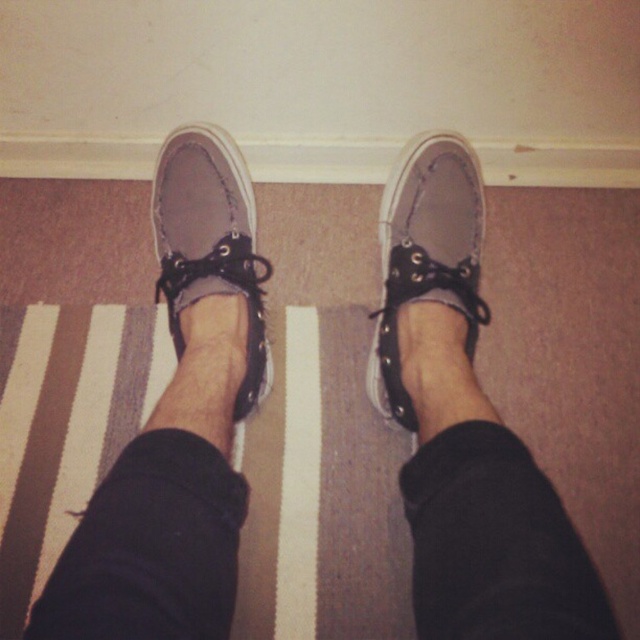
Question: Does gray suede shoe at center appear over matte gray ankle at center?

Choices:
 (A) yes
 (B) no

Answer: (A)

Question: Which point is closer to the camera?

Choices:
 (A) (177, 189)
 (B) (154, 506)
 (C) (451, 480)

Answer: (B)

Question: Which point is closer to the camera taking this photo?

Choices:
 (A) (225, 518)
 (B) (481, 237)

Answer: (A)

Question: Which point is closer to the camera taking this photo?

Choices:
 (A) (218, 259)
 (B) (483, 228)

Answer: (A)

Question: Is matte gray canvas shoe at center to the left of black suede ankle at center from the viewer's perspective?

Choices:
 (A) yes
 (B) no

Answer: (B)

Question: Does matte gray canvas shoe at center appear on the right side of black suede ankle at center?

Choices:
 (A) yes
 (B) no

Answer: (A)